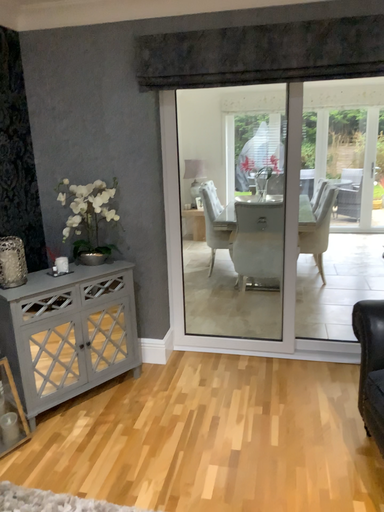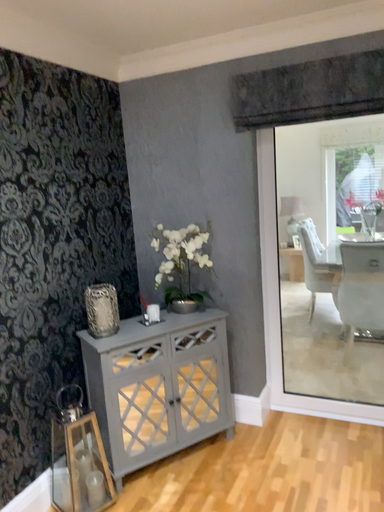
Question: Which way did the camera rotate in the video?

Choices:
 (A) rotated left
 (B) rotated right

Answer: (A)